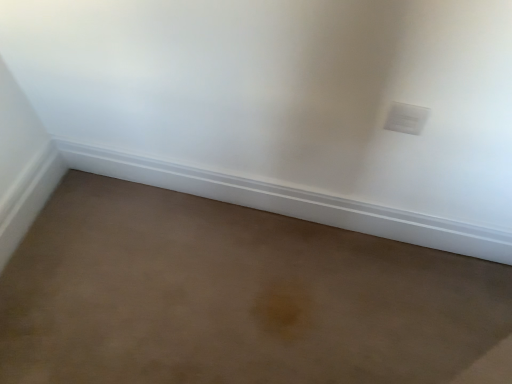
Describe the element at coordinates (406, 118) in the screenshot. I see `white plastic electric outlet at upper right` at that location.

Where is `white plastic electric outlet at upper right`? This screenshot has width=512, height=384. white plastic electric outlet at upper right is located at coordinates (406, 118).

Where is `white plastic electric outlet at upper right`? This screenshot has width=512, height=384. white plastic electric outlet at upper right is located at coordinates (406, 118).